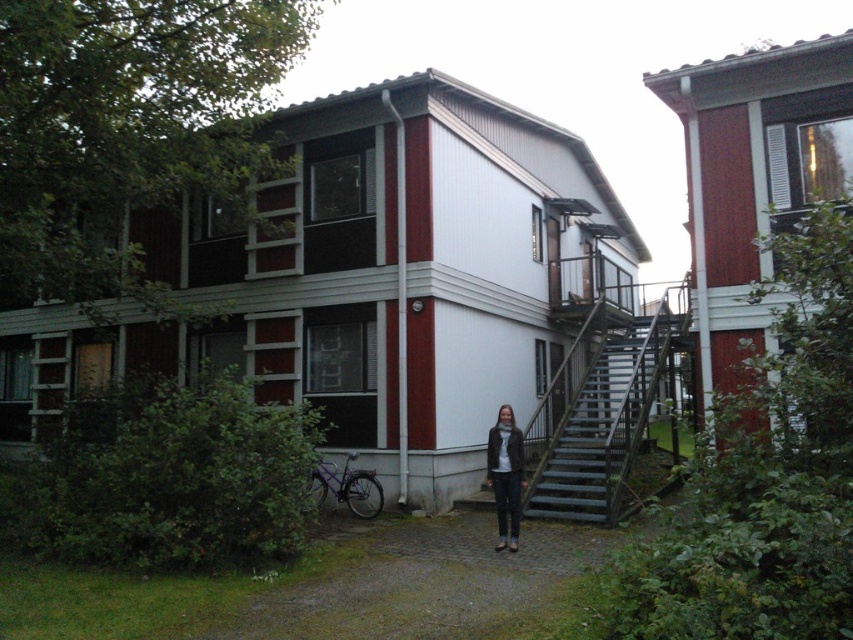
Question: Which object appears closest to the camera in this image?

Choices:
 (A) metallic gray stairs at center
 (B) leather jacket at center

Answer: (B)

Question: Is metallic gray stairs at center smaller than leather jacket at center?

Choices:
 (A) no
 (B) yes

Answer: (B)

Question: Is metallic gray stairs at center positioned at the back of leather jacket at center?

Choices:
 (A) no
 (B) yes

Answer: (B)

Question: Which of the following is the farthest from the observer?

Choices:
 (A) (668, 358)
 (B) (505, 452)

Answer: (A)

Question: Is metallic gray stairs at center above leather jacket at center?

Choices:
 (A) yes
 (B) no

Answer: (B)